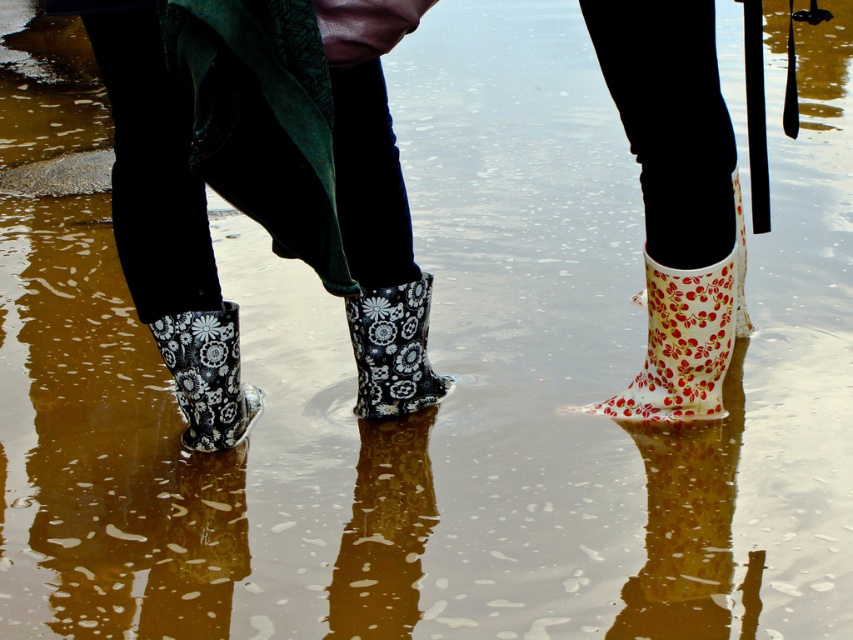
Based on the photo, you are designing a display for a shoe store and need to arrange the floral rubber boot at center and the floral matte rubber boot at lower left. Given their sizes, which boot should be placed in the main showcase to emphasize its prominence?

The floral matte rubber boot at lower left should be placed in the main showcase because it has a larger size than the floral rubber boot at center, making it more prominent.

You are standing in the shallow water and see two points marked in the image. Based on their positions, which point is closer to you, point (415, 369) or point (189, 406)?

Point (189, 406) is closer to you because point (415, 369) is behind it.

You are standing at the point marked as point (643, 406) in the image. The water here is 1 foot deep. If you want to walk to the nearest dry land, which direction should you move? Please answer with either left, right, forward, or backward.

The point (643, 406) is 9.67 feet away from the viewer. Since the water here is 1 foot deep, moving toward the viewer would lead to shallower water, so the nearest dry land is in the direction of the viewer. Therefore, you should move backward.